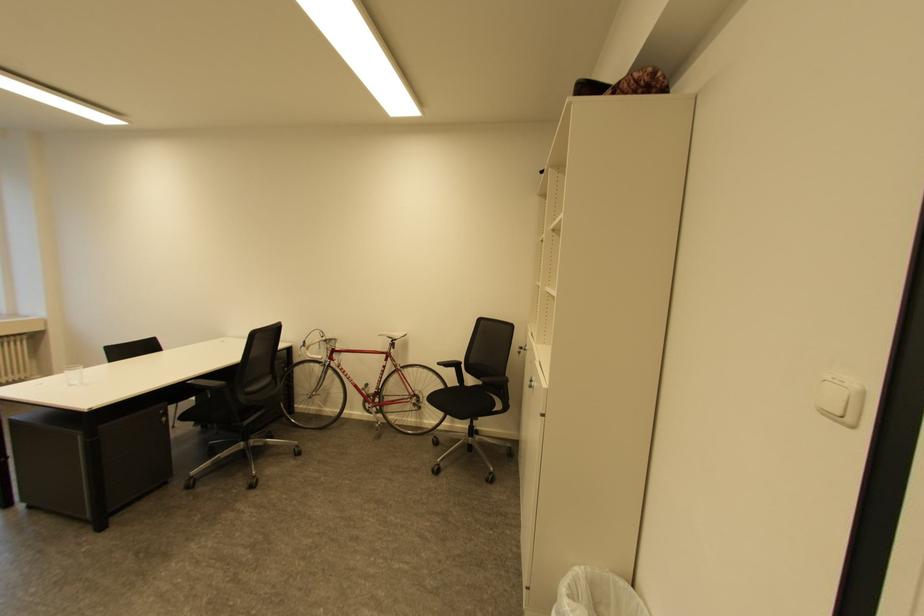
Find the location of a particular element. black chair armrest is located at coordinates (451, 365).